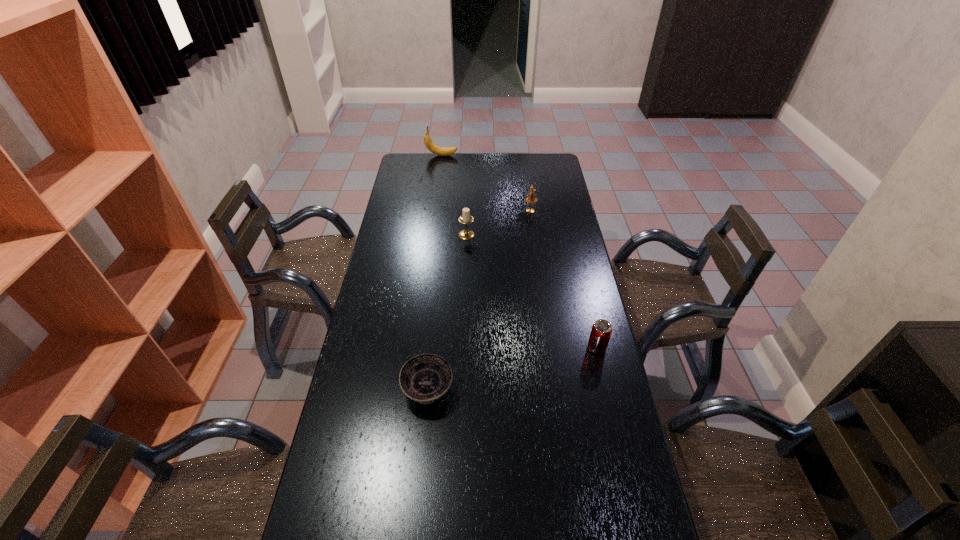
Where is `vacant area located 0.180m at the start of the peel on the tallest object`? vacant area located 0.180m at the start of the peel on the tallest object is located at coordinates (492, 156).

Image resolution: width=960 pixels, height=540 pixels. I want to click on blank space located 0.130m on the back of the left candle holder, so click(x=468, y=212).

Where is `free spot located 0.180m on the front of the fourth nearest object`? This screenshot has width=960, height=540. free spot located 0.180m on the front of the fourth nearest object is located at coordinates (535, 240).

Where is `vacant region located on the back of the fourth farthest object`? vacant region located on the back of the fourth farthest object is located at coordinates (577, 264).

I want to click on vacant space located 0.050m on the left of the nearest object, so click(x=385, y=390).

Identify the location of object that is at the far edge. (442, 151).

Identify the location of object that is at the left edge. Image resolution: width=960 pixels, height=540 pixels. (442, 151).

What are the coordinates of `candle holder located at the right edge` in the screenshot? It's located at (531, 198).

What are the coordinates of `soda can at the right edge` in the screenshot? It's located at (601, 331).

Locate an element on the screen. object that is positioned at the far left corner is located at coordinates (442, 151).